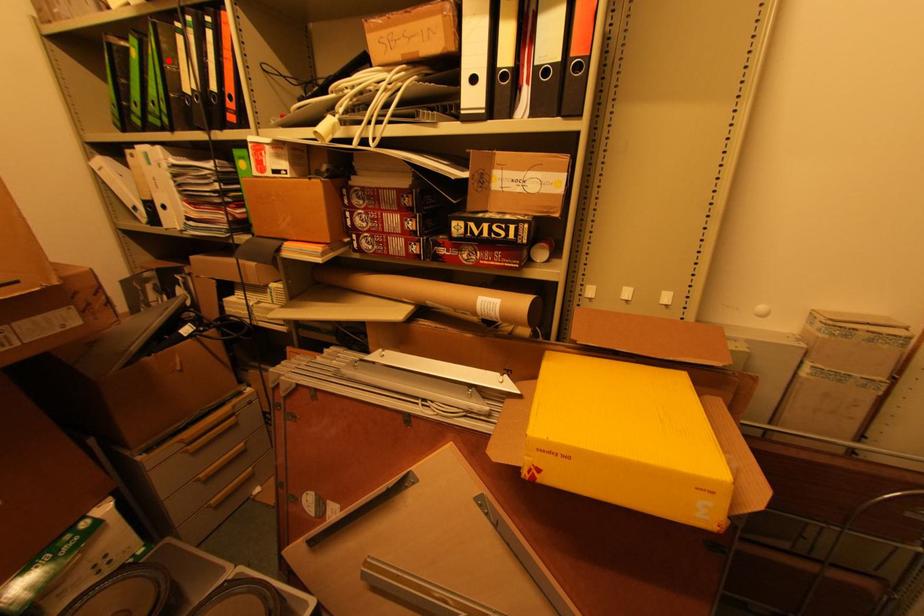
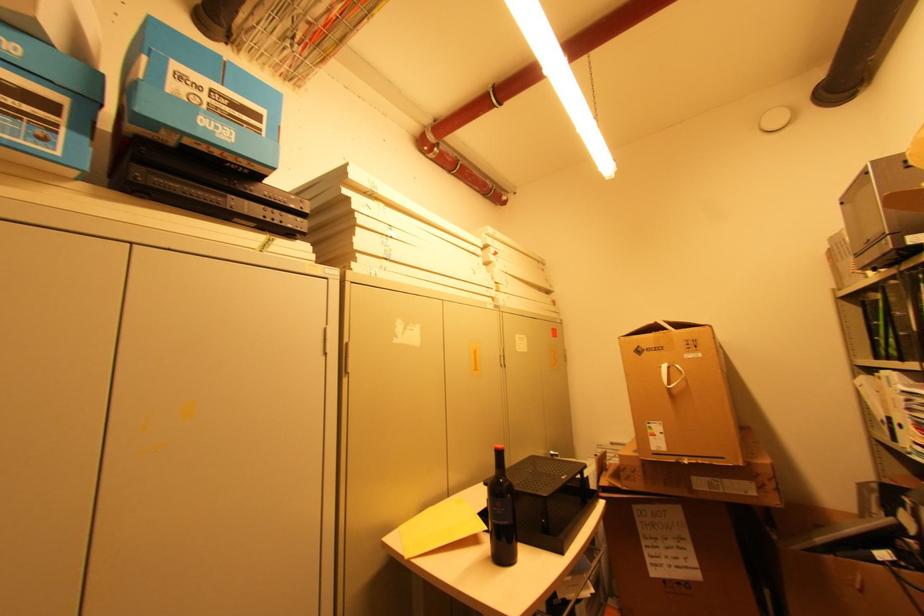
The point at the highlighted location is marked in the first image. Where is the corresponding point in the second image?

(896, 310)